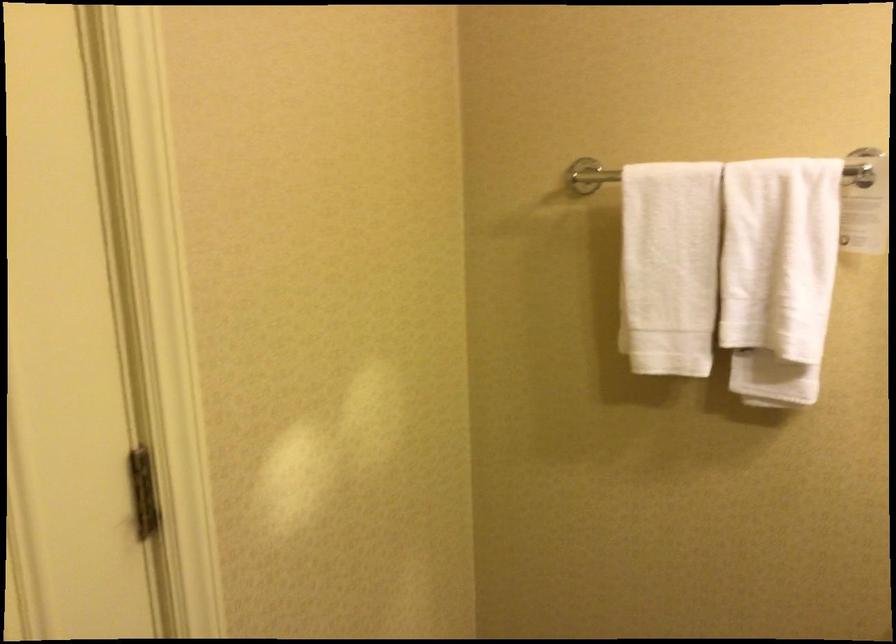
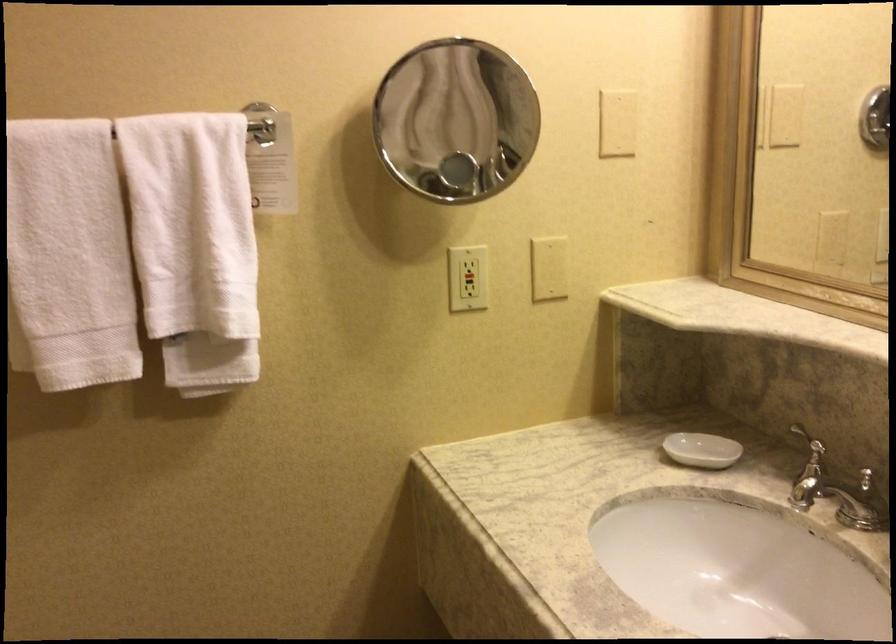
Find the pixel in the second image that matches point 673,270 in the first image.

(67, 257)